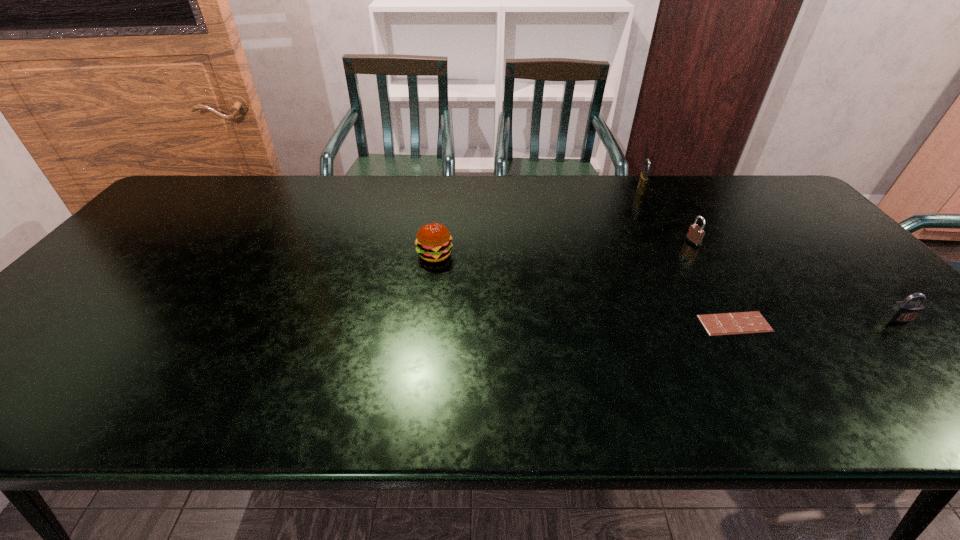
You are a GUI agent. You are given a task and a screenshot of the screen. Output one action in this format:
    pyautogui.click(x=<x>, y=<y>)
    Task: Click on the object that is the closest to the second farthest padlock
    The height and width of the screenshot is (540, 960).
    Given the screenshot: What is the action you would take?
    pyautogui.click(x=643, y=179)

Find the location of `object that is the second nearest to the farthest padlock`. object that is the second nearest to the farthest padlock is located at coordinates (740, 322).

Select which padlock appears as the closest to the rightmost padlock. Please provide its 2D coordinates. Your answer should be formatted as a tuple, i.e. [(x, y)], where the tuple contains the x and y coordinates of a point satisfying the conditions above.

[(695, 234)]

Where is `padlock object that ranks as the closest to the shortest object`? padlock object that ranks as the closest to the shortest object is located at coordinates (695, 234).

Identify the location of free space that satisfies the following two spatial constraints: 1. on the front side of the chocolate bar; 2. on the left side of the leftmost object. The height and width of the screenshot is (540, 960). (426, 323).

You are a GUI agent. You are given a task and a screenshot of the screen. Output one action in this format:
    pyautogui.click(x=<x>, y=<y>)
    Task: Click on the free space in the image that satisfies the following two spatial constraints: 1. on the back side of the leftmost object; 2. on the right side of the second nearest padlock
    The image size is (960, 540).
    Given the screenshot: What is the action you would take?
    pyautogui.click(x=436, y=242)